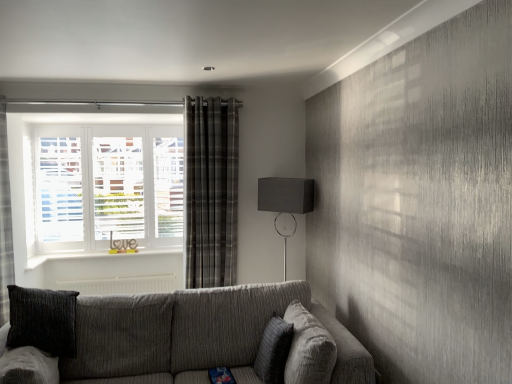
Question: From the image's perspective, does textured gray couch at lower center appear lower than textured gray pillow at center?

Choices:
 (A) no
 (B) yes

Answer: (B)

Question: Is textured gray couch at lower center at the left side of textured gray pillow at center?

Choices:
 (A) no
 (B) yes

Answer: (B)

Question: From a real-world perspective, is textured gray couch at lower center located beneath textured gray pillow at center?

Choices:
 (A) yes
 (B) no

Answer: (A)

Question: Is textured gray couch at lower center not near textured gray pillow at center?

Choices:
 (A) yes
 (B) no

Answer: (B)

Question: Is textured gray couch at lower center wider than textured gray pillow at center?

Choices:
 (A) yes
 (B) no

Answer: (A)

Question: From a real-world perspective, is metallic curtain rod at upper center above or below plaid fabric curtain at center?

Choices:
 (A) below
 (B) above

Answer: (B)

Question: Is metallic curtain rod at upper center in front of or behind plaid fabric curtain at center in the image?

Choices:
 (A) behind
 (B) front

Answer: (B)

Question: From the image's perspective, is metallic curtain rod at upper center above or below plaid fabric curtain at center?

Choices:
 (A) below
 (B) above

Answer: (B)

Question: Considering the positions of metallic curtain rod at upper center and plaid fabric curtain at center in the image, is metallic curtain rod at upper center wider or thinner than plaid fabric curtain at center?

Choices:
 (A) wide
 (B) thin

Answer: (B)

Question: From a real-world perspective, is textured gray couch at lower center positioned above or below metallic curtain rod at upper center?

Choices:
 (A) above
 (B) below

Answer: (B)

Question: In terms of width, does textured gray couch at lower center look wider or thinner when compared to metallic curtain rod at upper center?

Choices:
 (A) wide
 (B) thin

Answer: (A)

Question: Does point (325, 311) appear closer or farther from the camera than point (37, 102)?

Choices:
 (A) farther
 (B) closer

Answer: (B)

Question: Choose the correct answer: Is textured gray couch at lower center inside metallic curtain rod at upper center or outside it?

Choices:
 (A) inside
 (B) outside

Answer: (B)

Question: From the image's perspective, relative to matte black lampshade at upper right, is plaid fabric curtain at center above or below?

Choices:
 (A) below
 (B) above

Answer: (B)

Question: Considering the positions of plaid fabric curtain at center and matte black lampshade at upper right in the image, is plaid fabric curtain at center wider or thinner than matte black lampshade at upper right?

Choices:
 (A) thin
 (B) wide

Answer: (A)